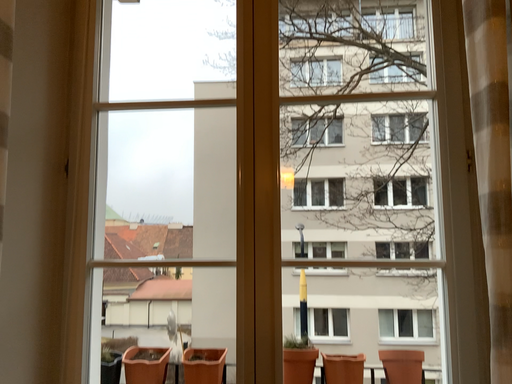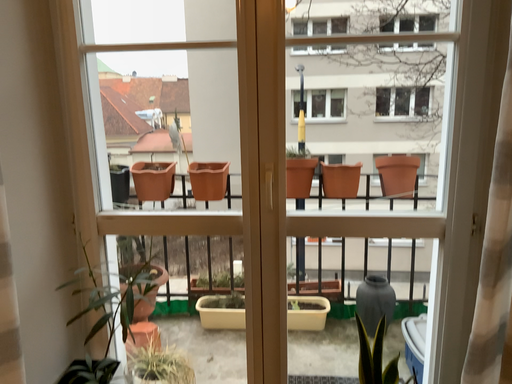
Question: Which way did the camera rotate in the video?

Choices:
 (A) rotated upward
 (B) rotated downward

Answer: (B)